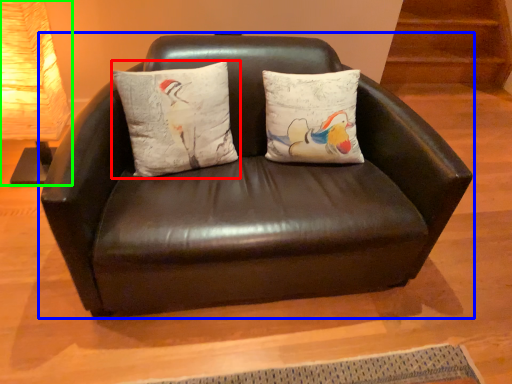
Question: Which object is positioned farthest from pillow (highlighted by a red box)? Select from studio couch (highlighted by a blue box) and table lamp (highlighted by a green box).

Choices:
 (A) studio couch
 (B) table lamp

Answer: (B)